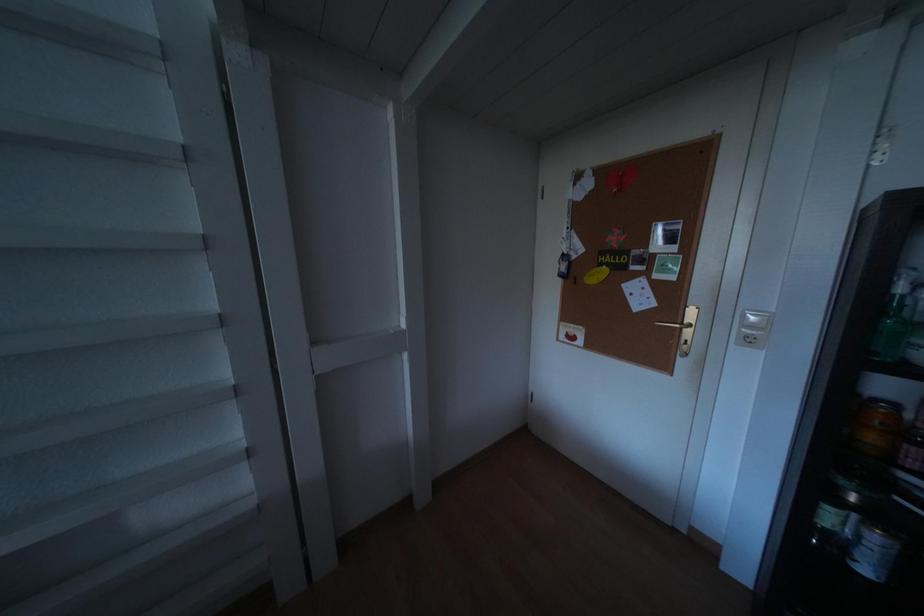
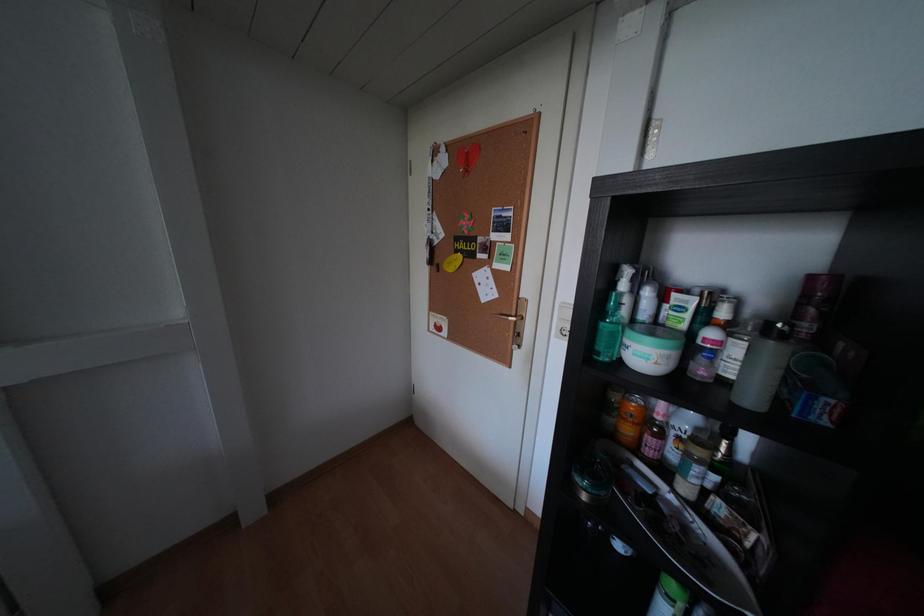
Question: The camera is either moving clockwise (left) or counter-clockwise (right) around the object. The first image is from the beginning of the video and the second image is from the end. Is the camera moving left or right when shooting the video?

Choices:
 (A) Left
 (B) Right

Answer: (A)